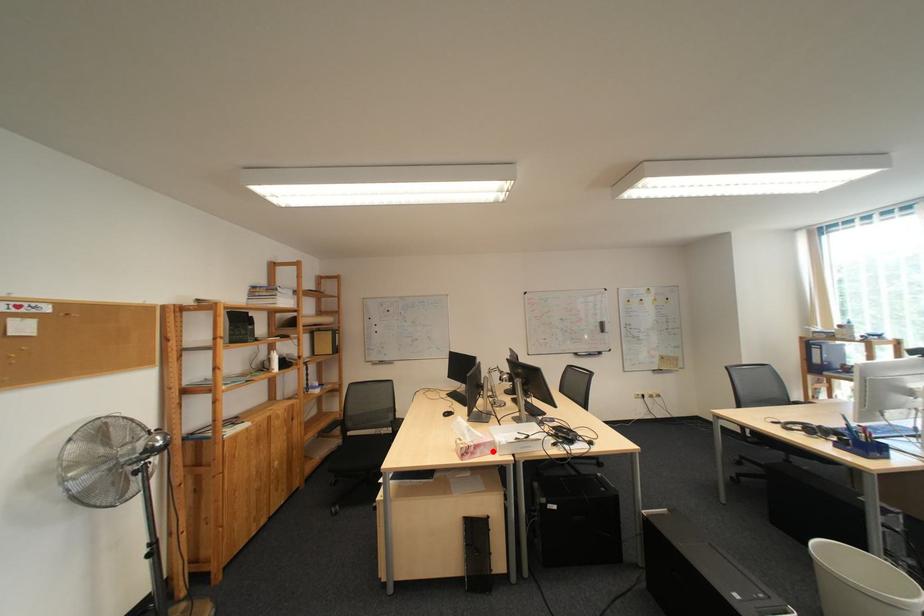
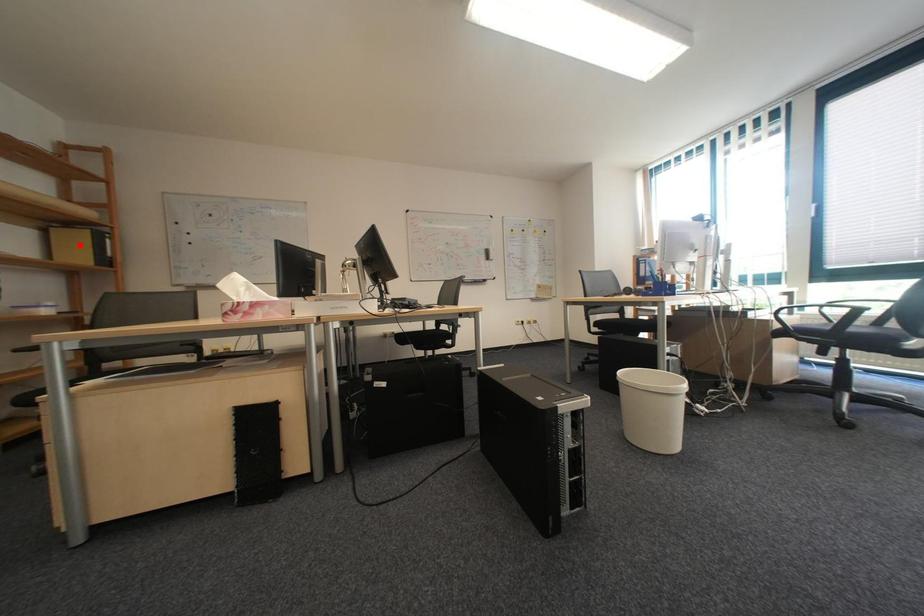
I am providing you with two images of the same scene from different viewpoints. A red point is marked on the first image and another point is marked on the second image. Does the point marked in image1 correspond to the same location as the one in image2?

No